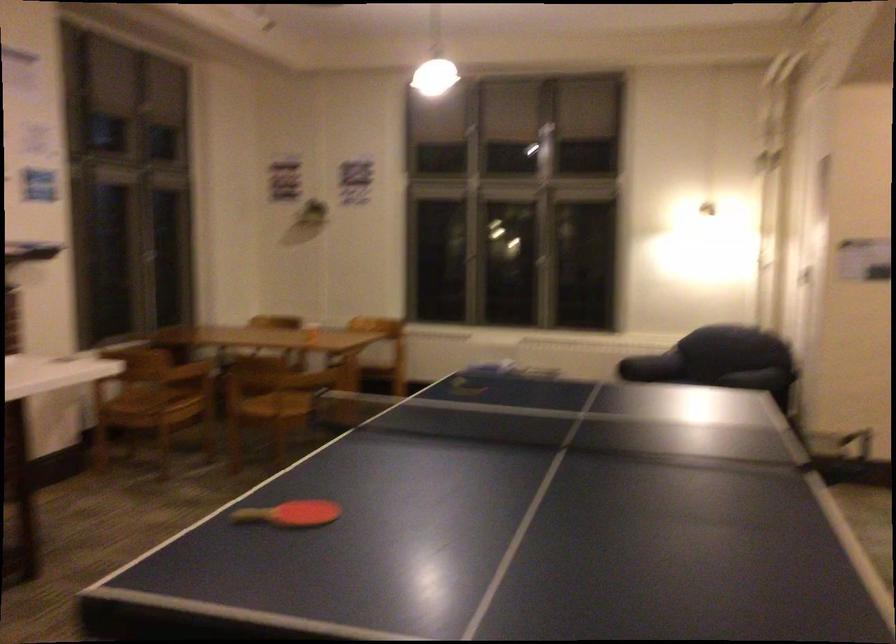
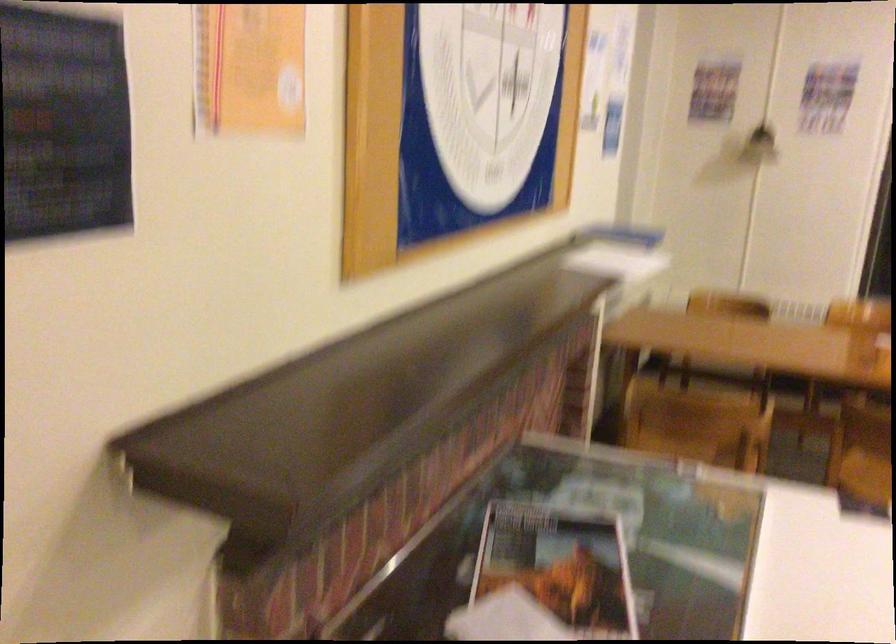
Which direction would the cameraman need to move to produce the second image?

The cameraman walked toward left, forward.